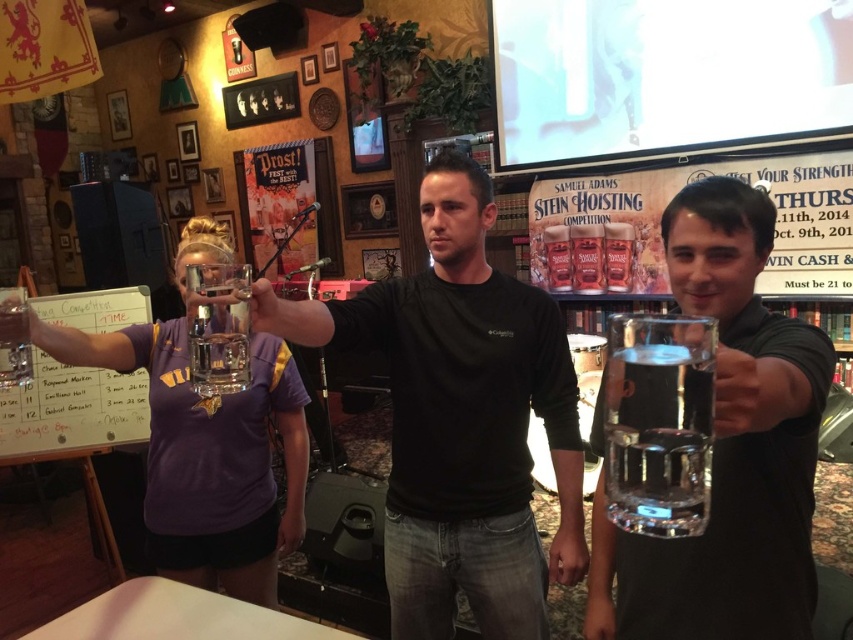
You are a bartender at the Samuel Adams Stein Hoisting Competition. You need to quickly identify which glass is closer to you to serve the next round. Based on the scene, which object is closer to you between the clear glass beer at center and the clear glass at center?

The clear glass beer at center is closer to you because it is in front of the clear glass at center.

What is the color of the shirt at the location specified by the point coordinates [461,419]?

The point coordinates [461,419] are on the black matte shirt at center, so the color is black.

You are a bartender at the Samuel Adams Stein Hoosing Competition. You need to place a new order of coasters between the black matte shirt at center and the clear glass beer at center. Which object should you place the coasters closer to, considering their widths?

The black matte shirt at center is wider than the clear glass beer at center, so you should place the coasters closer to the clear glass beer at center to accommodate the shirt.